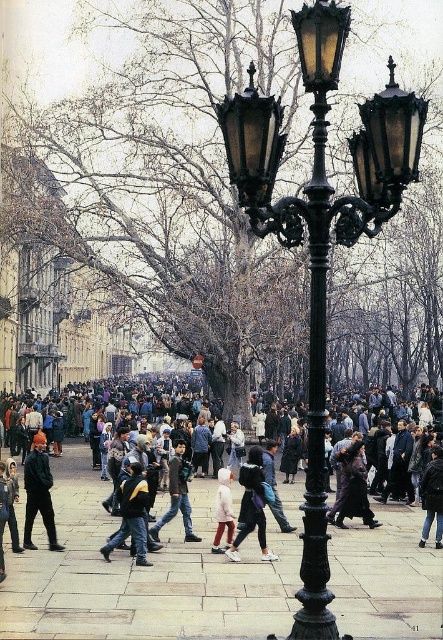
You are a photographer trying to capture a photo of the dark blue jacket at center. You see the dark gray jacket at lower left blocking your view. Can you move to the right to get a better shot?

The dark gray jacket at lower left is positioned on the left side of dark blue jacket at center, so moving to the right would allow you to avoid the obstruction and capture the dark blue jacket at center without the dark gray jacket at lower left blocking the view.

You are a photographer standing at the edge of the crowd. You want to take a photo that includes both the dark gray jacket at lower left and the dark blue jacket at center. Given that your camera has a 5 meter focal length, will both jackets be within the frame?

The dark gray jacket at lower left is 6.87 meters away from the dark blue jacket at center. Since the camera has a 5 meter focal length, the distance between them exceeds the camera range, so both jackets cannot be captured in the same frame.